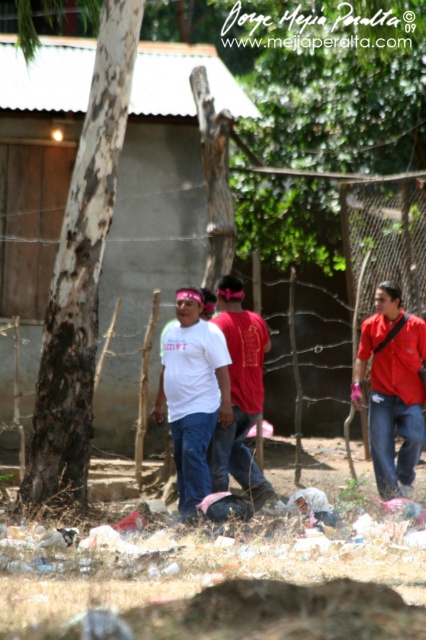
Question: Is concrete wall at center to the right of brown rough bark tree at left from the viewer's perspective?

Choices:
 (A) no
 (B) yes

Answer: (B)

Question: Which of the following is the farthest from the observer?

Choices:
 (A) concrete wall at center
 (B) brown rough bark tree at left
 (C) wire mesh fence at center
 (D) white matte t-shirt at center

Answer: (C)

Question: Is concrete wall at center bigger than white matte t-shirt at center?

Choices:
 (A) no
 (B) yes

Answer: (B)

Question: Is wire mesh fence at center further to camera compared to matte red shirt at center?

Choices:
 (A) yes
 (B) no

Answer: (A)

Question: Among these points, which one is farthest from the camera?

Choices:
 (A) (353, 291)
 (B) (51, 92)

Answer: (A)

Question: Among these points, which one is nearest to the camera?

Choices:
 (A) (232, 300)
 (B) (13, 154)
 (C) (176, 346)

Answer: (C)